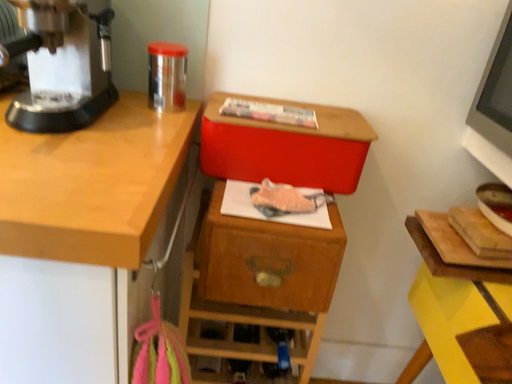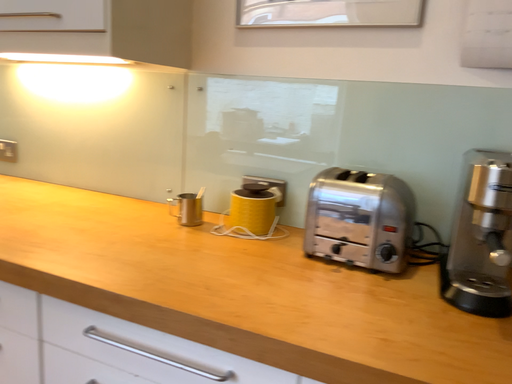
Question: Which way did the camera rotate in the video?

Choices:
 (A) rotated right
 (B) rotated left

Answer: (B)